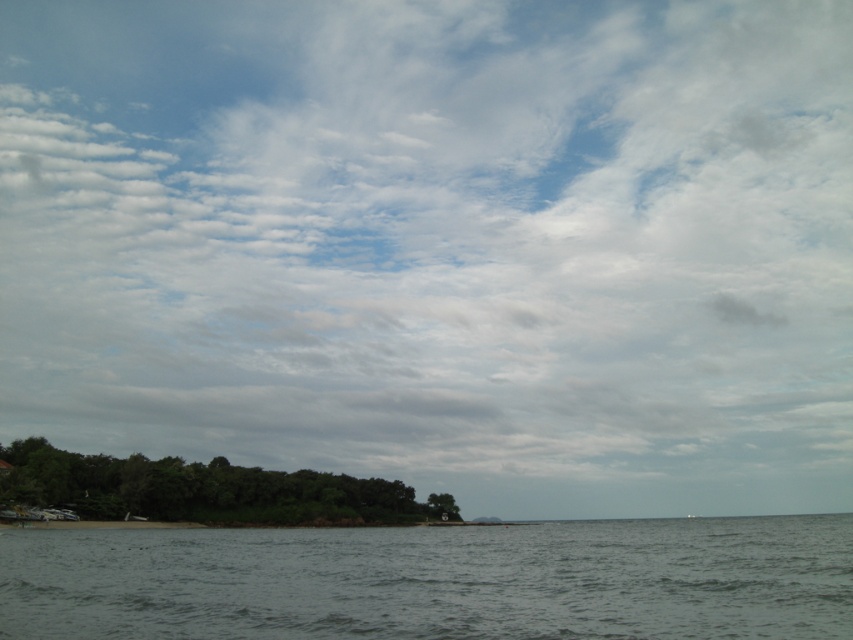
You are standing on the beach looking at the coastal scene. There are two points marked in the image. The first point is at coordinates point (769, 618) and the second point is at point (146, 502). Which point is closer to you?

Point (769, 618) is closer to the camera than point (146, 502), so the first point is closer to you.

You are standing on the beach and want to take a photo of both the gray matte water at lower center and the green leafy island at lower left. Since you have a camera with a fixed focal length, you need to adjust your position so both objects are fully visible in the frame. Which object should you move closer to in order to include both in your photo?

To include both the gray matte water at lower center and the green leafy island at lower left in the photo, you should move closer to the green leafy island at lower left. Since the gray matte water at lower center is taller than the green leafy island at lower left, moving closer to the shorter object will help balance their sizes in the frame, ensuring both are fully visible.

In the scene shown: You are standing on the beach and see the gray matte water at lower center and the green leafy island at lower left. Which object takes up more horizontal space in the image?

The gray matte water at lower center takes up more horizontal space because its width is larger than the green leafy island at lower left.